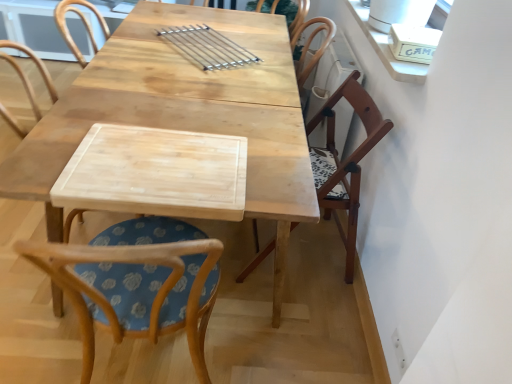
Question: Looking at the image, does wooden chair at right, which ranks as the 2th chair in left-to-right order, seem bigger or smaller compared to natural wood table at center?

Choices:
 (A) small
 (B) big

Answer: (A)

Question: In the image, is wooden chair at right, which appears as the 1th chair when viewed from the right, on the left side or the right side of natural wood table at center?

Choices:
 (A) left
 (B) right

Answer: (B)

Question: Which object is the closest to the natural wood cutting board at center?

Choices:
 (A) natural wood table at center
 (B) wooden chair with floral cushion at center, arranged as the second chair when viewed from the right
 (C) wooden chair at right, which appears as the 1th chair when viewed from the right

Answer: (B)

Question: Estimate the real-world distances between objects in this image. Which object is closer to the wooden chair at right, which ranks as the 2th chair in left-to-right order?

Choices:
 (A) wooden chair with floral cushion at center, the first chair positioned from the left
 (B) natural wood cutting board at center
 (C) natural wood table at center

Answer: (C)